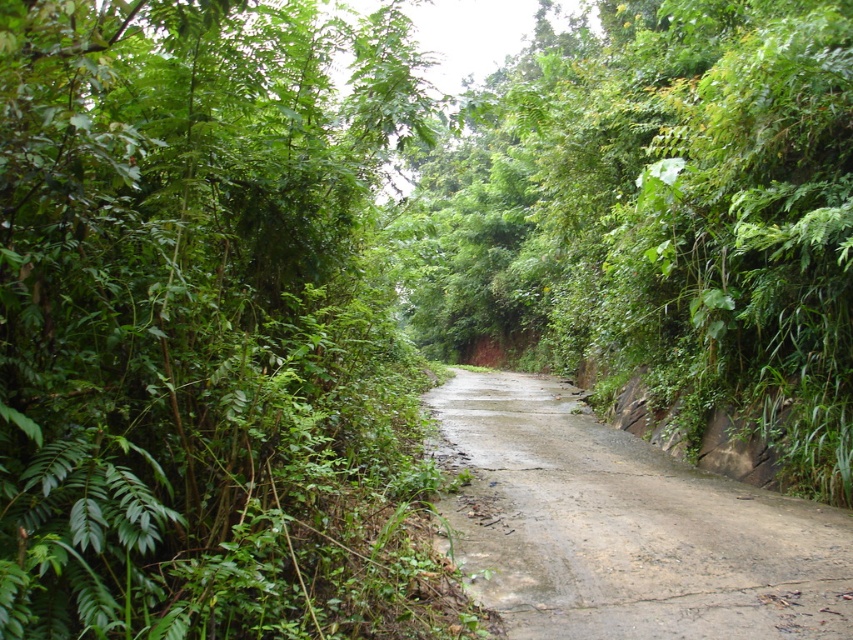
Question: Which point is farther to the camera?

Choices:
 (A) green leafy tree at left
 (B) dull gray concrete at center

Answer: (B)

Question: Considering the relative positions of green leafy tree at left and green leafy tree at center in the image provided, where is green leafy tree at left located with respect to green leafy tree at center?

Choices:
 (A) below
 (B) above

Answer: (A)

Question: Does green leafy tree at center have a lesser width compared to dull gray concrete at center?

Choices:
 (A) no
 (B) yes

Answer: (A)

Question: Which object is farther from the camera taking this photo?

Choices:
 (A) dull gray concrete at center
 (B) green leafy tree at left
 (C) green leafy tree at center

Answer: (C)

Question: Is green leafy tree at left positioned behind green leafy tree at center?

Choices:
 (A) no
 (B) yes

Answer: (A)

Question: Estimate the real-world distances between objects in this image. Which object is farther from the green leafy tree at center?

Choices:
 (A) green leafy tree at left
 (B) dull gray concrete at center

Answer: (B)